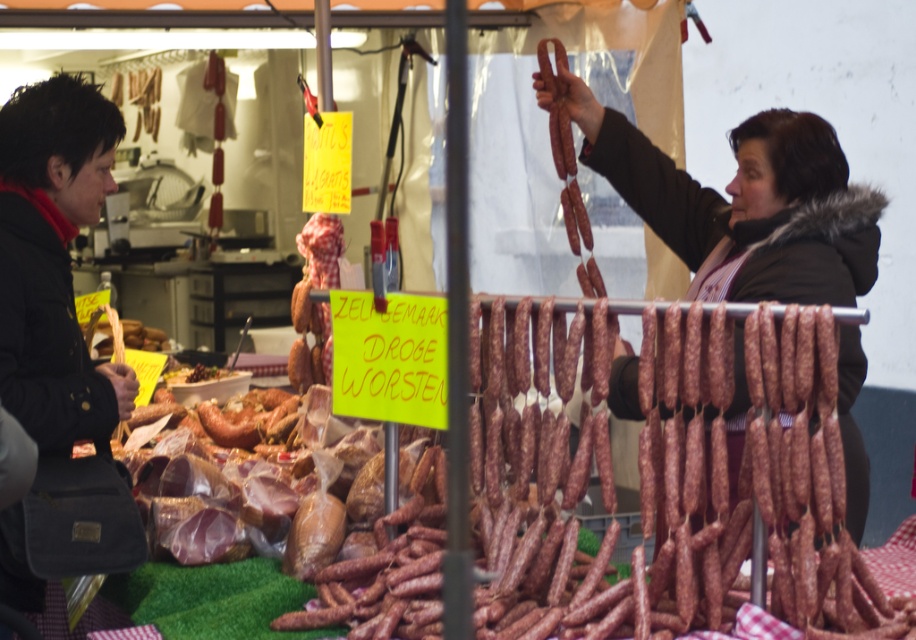
You are a customer at the market and want to buy both the black fabric bag at left and the shiny brown meat at center. Which item is larger in size?

The black fabric bag at left is bigger than the shiny brown meat at center.

You are a customer at the market and want to buy the shiny brown meat at center. You notice a black fabric bag at left nearby. Which object is positioned to the right of the other?

The black fabric bag at left is to the right of the shiny brown meat at center.